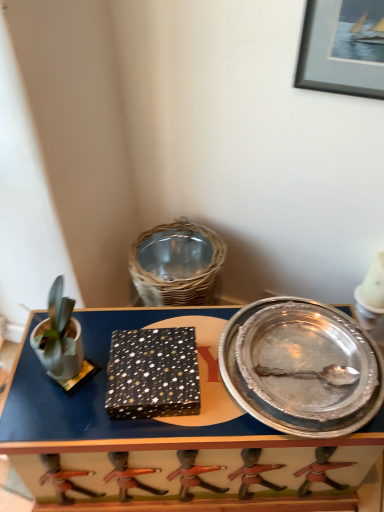
Question: From a real-world perspective, is metallic silver tray at center positioned above or below silver/metallic platter at right?

Choices:
 (A) above
 (B) below

Answer: (B)

Question: In the image, is metallic silver tray at center positioned in front of or behind silver/metallic platter at right?

Choices:
 (A) front
 (B) behind

Answer: (B)

Question: Which of these objects is positioned farthest from the black matte picture frame at upper right?

Choices:
 (A) metallic silver tray at center
 (B) silver/metallic platter at right

Answer: (A)

Question: Which is farther from the black matte picture frame at upper right?

Choices:
 (A) silver/metallic platter at right
 (B) metallic silver tray at center

Answer: (B)